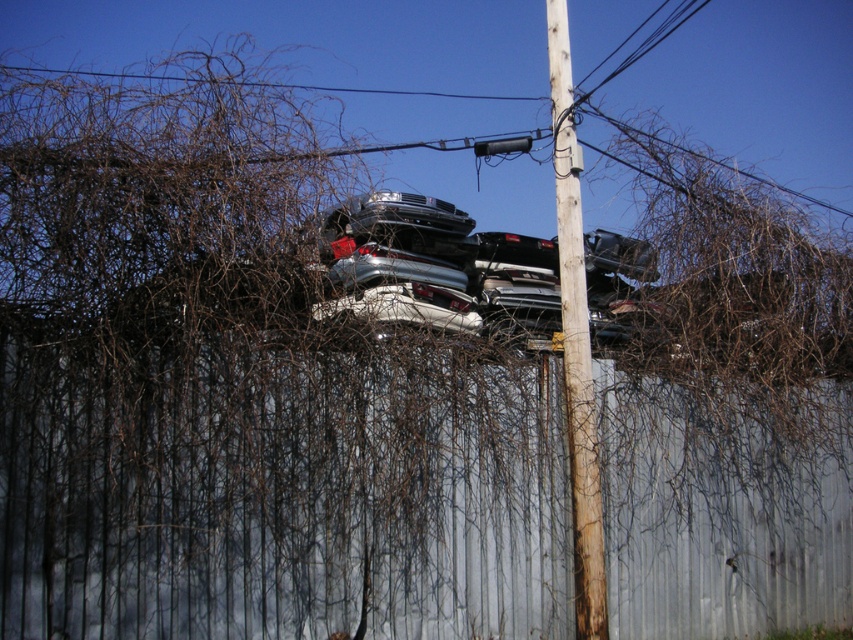
You are a painter who needs to paint the wooden telephone pole at center and the shiny silver car at center. If you have a ladder that can reach 3 meters, will you be able to paint the top of both objects without needing a taller ladder?

The wooden telephone pole at center is taller than the shiny silver car at center. Since the ladder can only reach 3 meters, you might not be able to paint the top of the telephone pole if it exceeds that height, but the car should be accessible.

You are a painter who needs to paint the metallic gray fence at upper center and the silver metallic car at center. If you have enough paint for 10 square meters, which object requires more paint based on their widths?

The metallic gray fence at upper center requires more paint because its width is larger than the silver metallic car at center, so it has a greater surface area to cover.